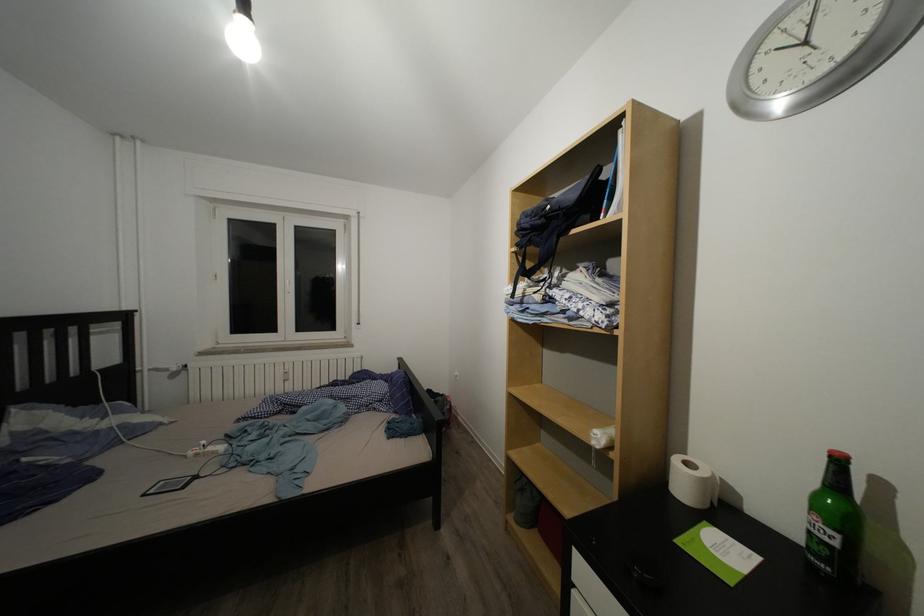
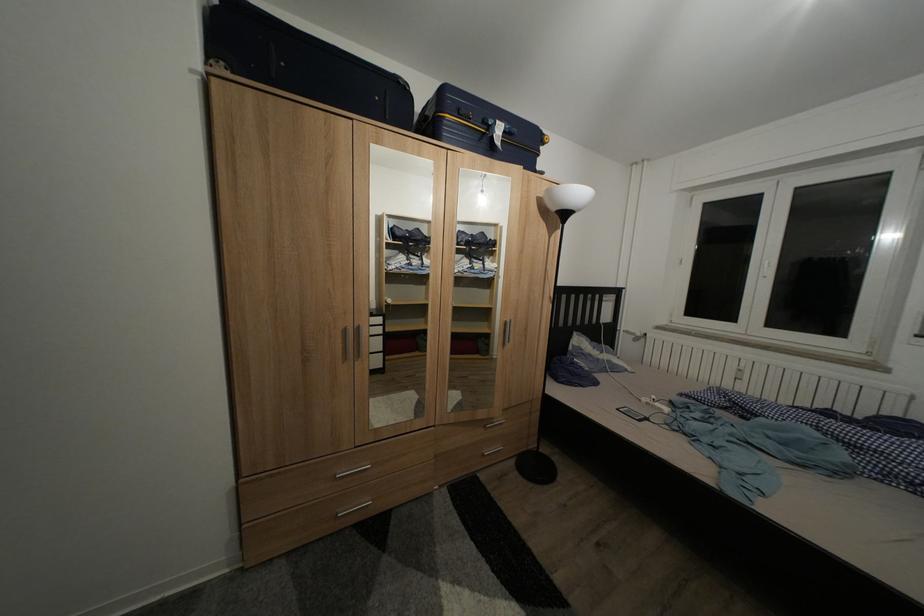
Question: The camera is either moving clockwise (left) or counter-clockwise (right) around the object. The first image is from the beginning of the video and the second image is from the end. Is the camera moving left or right when shooting the video?

Choices:
 (A) Left
 (B) Right

Answer: (B)